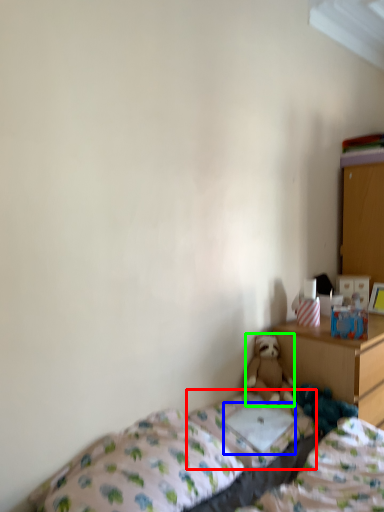
Question: Which object is the closest to the mattress (highlighted by a red box)? Choose among these: pillow (highlighted by a blue box) or teddy bear (highlighted by a green box).

Choices:
 (A) pillow
 (B) teddy bear

Answer: (A)